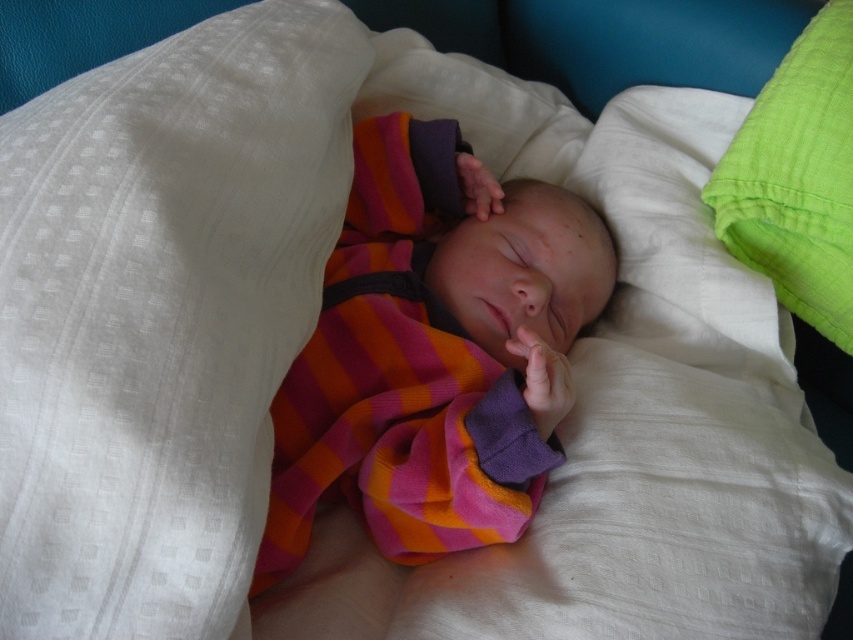
Where is the striped fleece onesie at center located in the image?

The striped fleece onesie at center is located at point (434, 352).

You are a parent checking on your baby. You notice the white textured pillow at upper left and the green cotton pillow at upper right. Which pillow is taller?

The white textured pillow at upper left is taller than the green cotton pillow at upper right according to the description.